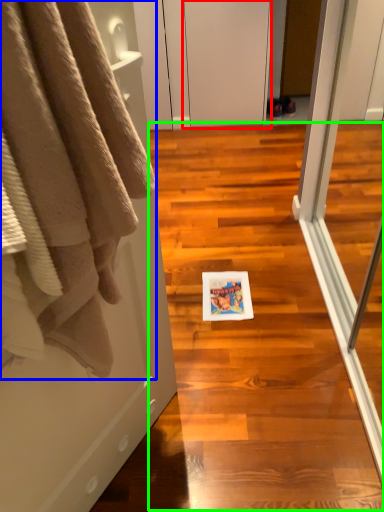
Question: Which object is positioned farthest from screen door (highlighted by a red box)? Select from towel (highlighted by a blue box) and stair (highlighted by a green box).

Choices:
 (A) towel
 (B) stair

Answer: (A)